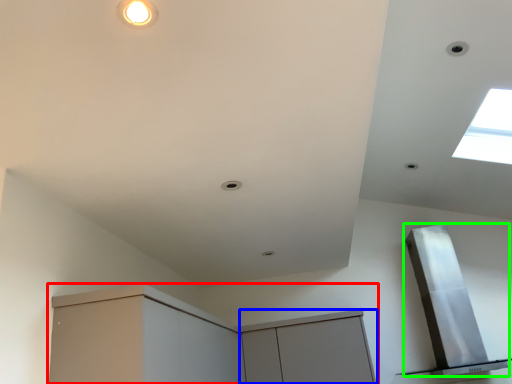
Question: Considering the real-world distances, which object is farthest from cabinetry (highlighted by a red box)? cabinetry (highlighted by a blue box) or exhaust hood (highlighted by a green box)?

Choices:
 (A) cabinetry
 (B) exhaust hood

Answer: (B)